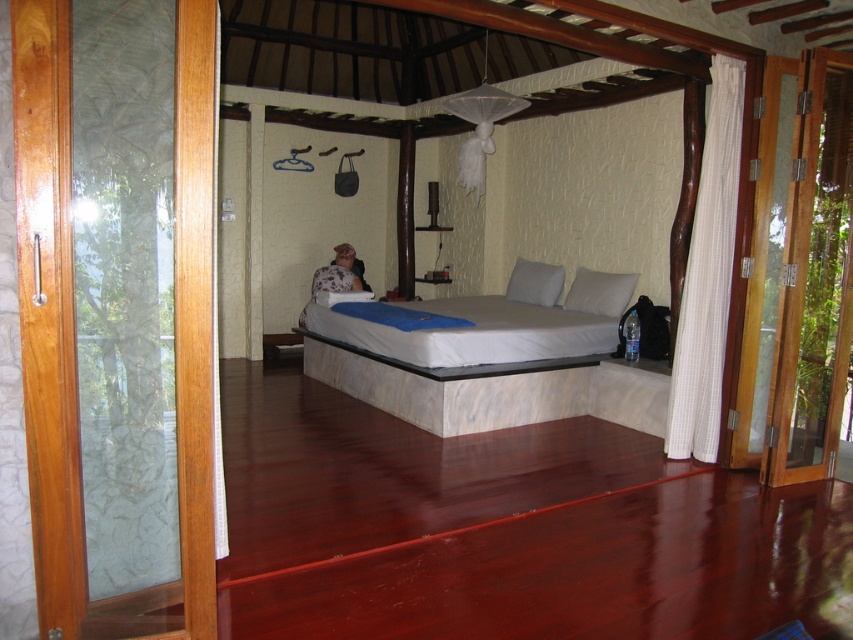
Question: Among these objects, which one is farthest from the camera?

Choices:
 (A) light gray fabric pillow at center
 (B) white woven curtain at right
 (C) white marble bed at center

Answer: (A)

Question: Is transparent glass door at left behind white matte pillow at center?

Choices:
 (A) yes
 (B) no

Answer: (B)

Question: Where is white woven curtain at right located in relation to white matte pillow at center in the image?

Choices:
 (A) left
 (B) right

Answer: (B)

Question: From the image, what is the correct spatial relationship of white woven curtain at right in relation to white matte pillow at center?

Choices:
 (A) below
 (B) above

Answer: (A)

Question: Which point is farther to the camera?

Choices:
 (A) floral fabric woman at center
 (B) transparent glass door at left
 (C) white woven curtain at right
 (D) white matte pillow at center

Answer: (D)

Question: Estimate the real-world distances between objects in this image. Which object is closer to the light gray fabric pillow at center?

Choices:
 (A) white marble bed at center
 (B) transparent glass door at left

Answer: (A)